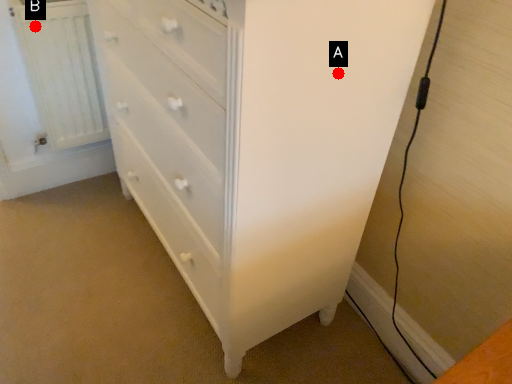
Question: Two points are circled on the image, labeled by A and B beside each circle. Which point is closer to the camera?

Choices:
 (A) A is closer
 (B) B is closer

Answer: (A)